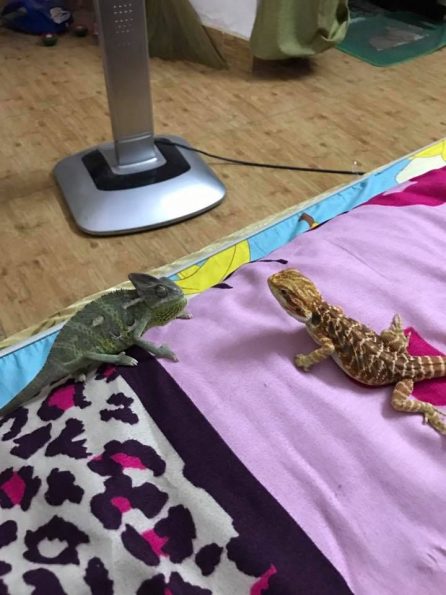
Image resolution: width=446 pixels, height=595 pixels. I want to click on wooden floor, so click(183, 234).